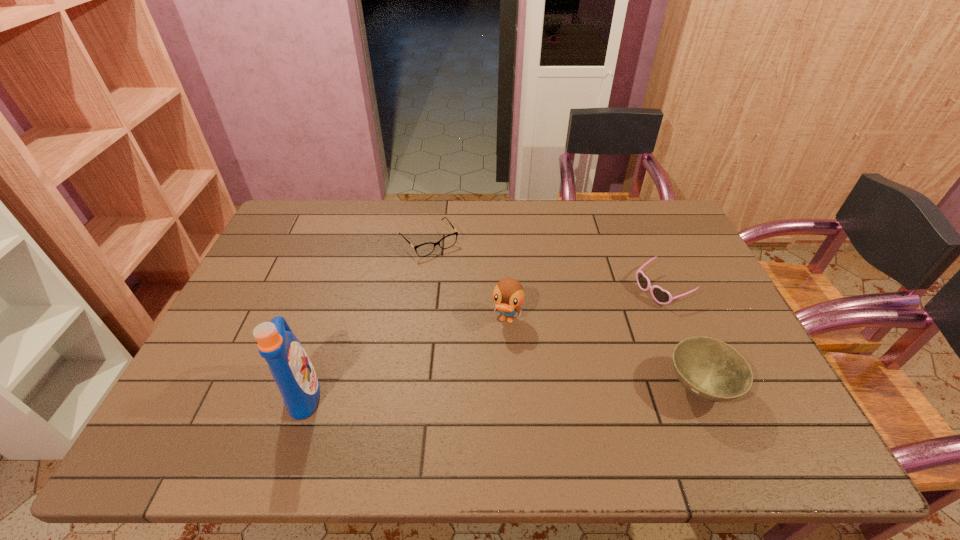
The width and height of the screenshot is (960, 540). In order to click on vacant space at the far right corner of the desktop in this screenshot , I will do `click(635, 212)`.

I want to click on vacant area at the near right corner, so click(757, 400).

Image resolution: width=960 pixels, height=540 pixels. Find the location of `vacant space in between the second tallest object and the third tallest object`. vacant space in between the second tallest object and the third tallest object is located at coordinates tap(603, 354).

At what (x,y) coordinates should I click in order to perform the action: click on free spot between the farthest object and the tallest object. Please return your answer as a coordinate pair (x, y). The image size is (960, 540). Looking at the image, I should click on pyautogui.click(x=367, y=317).

Identify the location of unoccupied position between the third object from left to right and the sunglasses. The width and height of the screenshot is (960, 540). (585, 305).

Where is `vacant area between the farthest object and the duck`? vacant area between the farthest object and the duck is located at coordinates (468, 281).

Where is `vacant region between the shortest object and the fourth shortest object`? This screenshot has width=960, height=540. vacant region between the shortest object and the fourth shortest object is located at coordinates (468, 281).

Locate an element on the screen. free area in between the sunglasses and the second object from left to right is located at coordinates (545, 265).

Find the location of a particular element. The image size is (960, 540). blank region between the duck and the bowl is located at coordinates (603, 354).

Find the location of a particular element. The image size is (960, 540). free space that is in between the sunglasses and the tallest object is located at coordinates [483, 341].